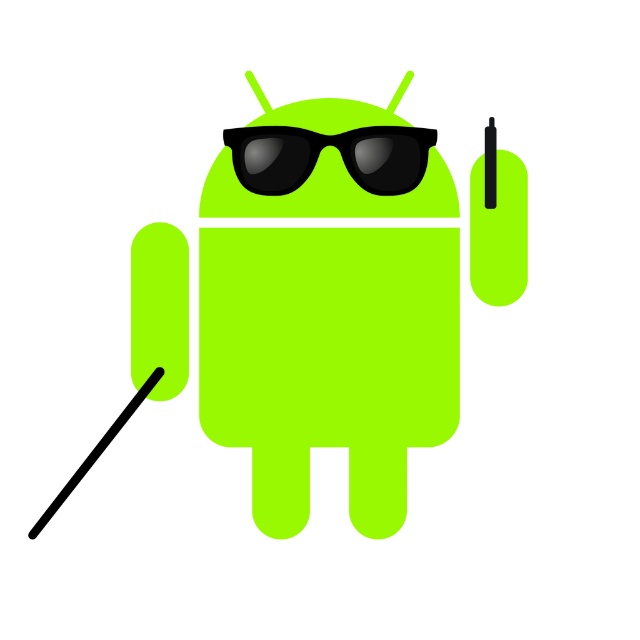
Question: Does lime matte android at center appear on the right side of black matte sunglasses at upper center?

Choices:
 (A) no
 (B) yes

Answer: (A)

Question: Considering the relative positions of lime matte android at center and black matte sunglasses at upper center in the image provided, where is lime matte android at center located with respect to black matte sunglasses at upper center?

Choices:
 (A) above
 (B) below

Answer: (B)

Question: Can you confirm if lime matte android at center is bigger than black matte sunglasses at upper center?

Choices:
 (A) no
 (B) yes

Answer: (B)